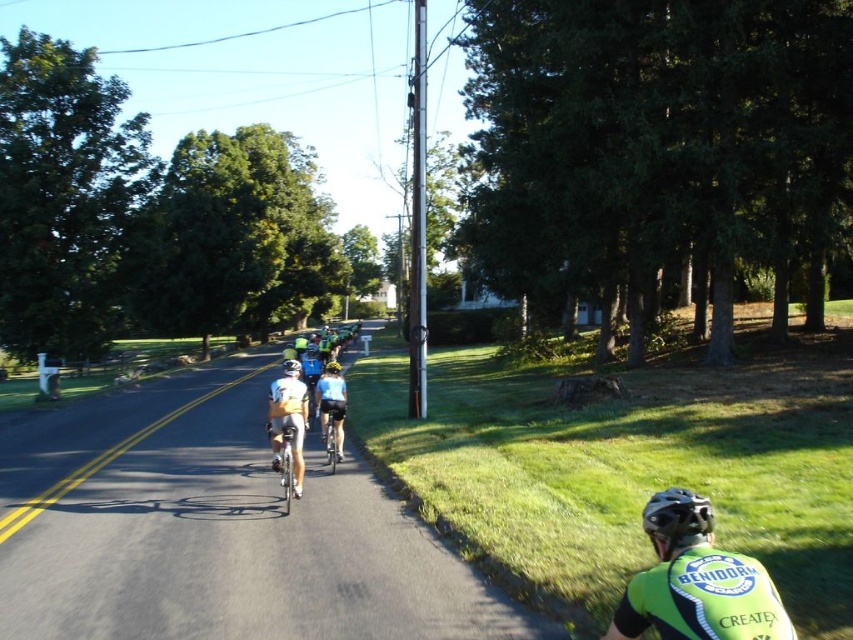
You are a photographer positioned at the side of the road. You want to capture a photo of the shiny silver bicycle at center and the yellow matte helmet at center. Which object should you focus on if you want to highlight the one that is taller?

The shiny silver bicycle at center is taller than the yellow matte helmet at center, so you should focus on the shiny silver bicycle at center to highlight its height.

You are a photographer positioned at the starting line of a cycling race. You want to take a photo of the matte yellow helmet at center and the shiny blue bicycle at center. Based on their positions, which object will appear closer to you in the photo?

The shiny blue bicycle at center will appear closer to you in the photo because the matte yellow helmet at center is positioned behind it.